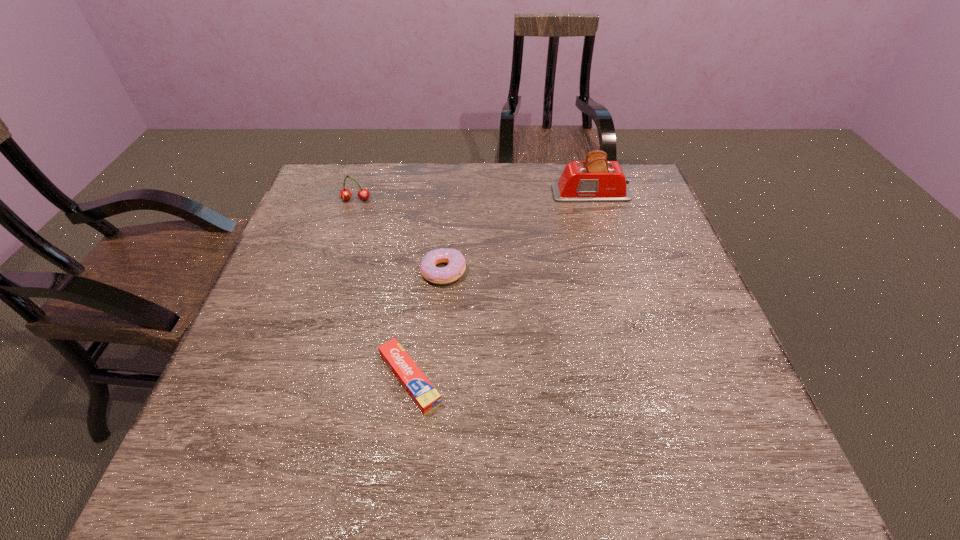
Locate an element on the screen. The height and width of the screenshot is (540, 960). free location located on the right of the doughnut is located at coordinates coord(502,271).

Locate an element on the screen. The image size is (960, 540). vacant space located 0.200m on the back of the shortest object is located at coordinates (422, 279).

The width and height of the screenshot is (960, 540). In order to click on toaster at the far edge in this screenshot , I will do `click(595, 180)`.

You are a GUI agent. You are given a task and a screenshot of the screen. Output one action in this format:
    pyautogui.click(x=<x>, y=<y>)
    Task: Click on the cherry located in the far edge section of the desktop
    The image size is (960, 540).
    Given the screenshot: What is the action you would take?
    pyautogui.click(x=345, y=194)

Where is `object that is at the left edge`? object that is at the left edge is located at coordinates (345, 194).

The image size is (960, 540). In order to click on object at the right edge in this screenshot , I will do `click(595, 180)`.

Find the location of `object present at the far left corner`. object present at the far left corner is located at coordinates (345, 194).

Where is `object present at the far right corner`? Image resolution: width=960 pixels, height=540 pixels. object present at the far right corner is located at coordinates (595, 180).

This screenshot has height=540, width=960. In the image, there is a desktop. In order to click on vacant space at the far edge in this screenshot , I will do `click(532, 165)`.

Where is `free space at the left edge of the desktop`? free space at the left edge of the desktop is located at coordinates (315, 256).